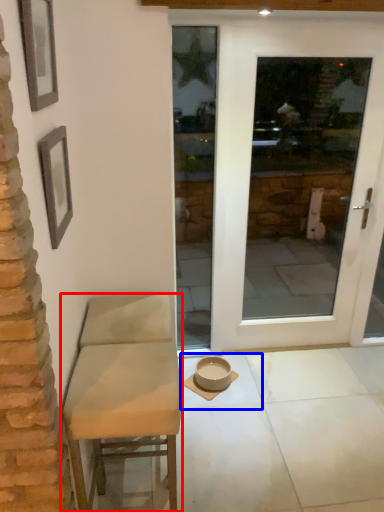
Question: Which point is closer to the camera, chair (highlighted by a red box) or tile (highlighted by a blue box)?

Choices:
 (A) chair
 (B) tile

Answer: (A)